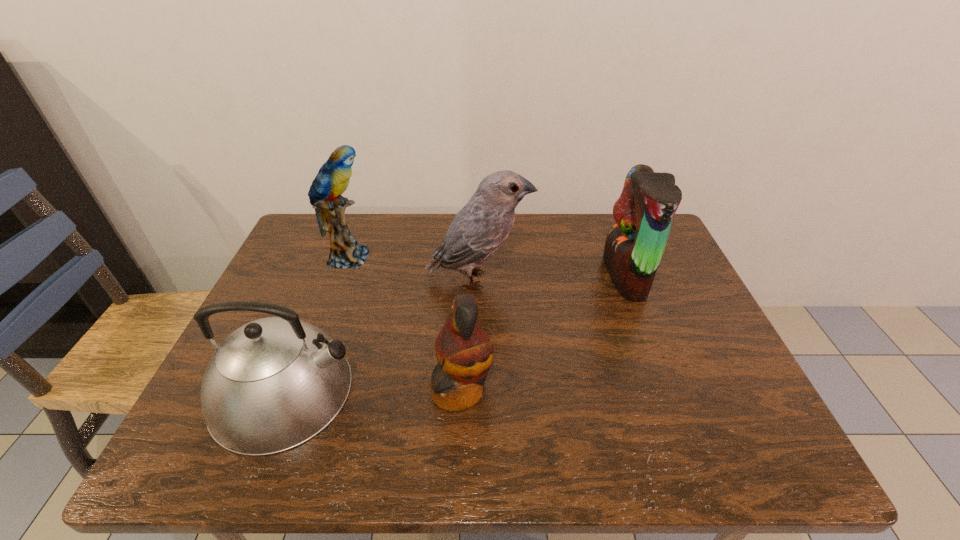
In order to click on object that is at the near edge in this screenshot , I will do `click(274, 383)`.

At what (x,y) coordinates should I click in order to perform the action: click on parrot located at the left edge. Please return your answer as a coordinate pair (x, y). Looking at the image, I should click on (332, 180).

Where is `kettle situated at the left edge`? This screenshot has height=540, width=960. kettle situated at the left edge is located at coordinates (274, 383).

Where is `object that is at the right edge`? The width and height of the screenshot is (960, 540). object that is at the right edge is located at coordinates (634, 247).

Identify the location of object positioned at the far left corner. (332, 180).

Where is `object that is at the near left corner`? The image size is (960, 540). object that is at the near left corner is located at coordinates (274, 383).

Where is `object that is positioned at the far right corner`? This screenshot has height=540, width=960. object that is positioned at the far right corner is located at coordinates point(634,247).

Identify the location of free point at the far edge. This screenshot has height=540, width=960. (381, 221).

Image resolution: width=960 pixels, height=540 pixels. I want to click on vacant area at the near edge, so click(x=376, y=447).

Locate an element on the screen. This screenshot has height=540, width=960. vacant space at the left edge of the desktop is located at coordinates (289, 275).